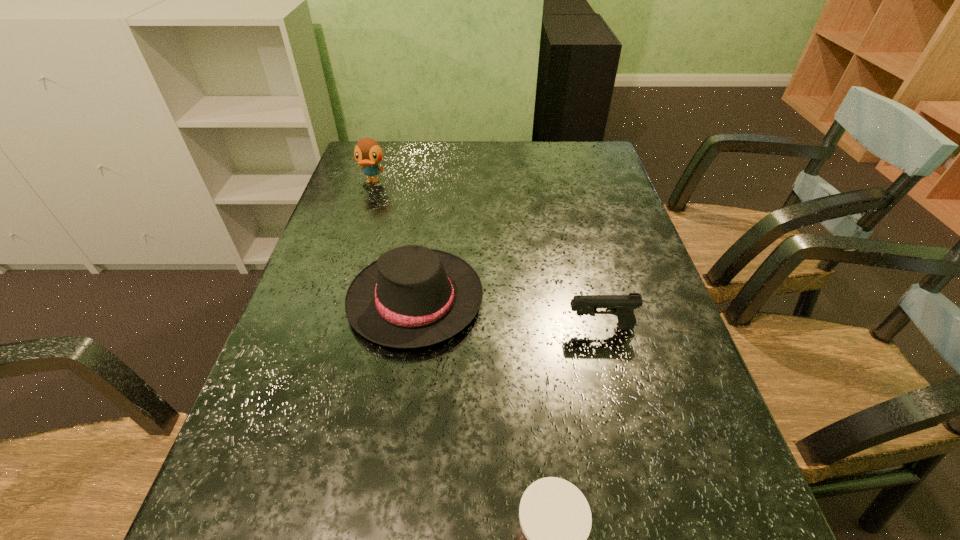
Find the location of a particular element. This screenshot has width=960, height=540. vacant space in between the dress hat and the duck is located at coordinates pyautogui.click(x=394, y=241).

Find the location of a particular element. This screenshot has width=960, height=540. empty location between the duck and the dress hat is located at coordinates point(394,241).

I want to click on empty space that is in between the dress hat and the farthest object, so click(x=394, y=241).

Find the location of a particular element. The height and width of the screenshot is (540, 960). vacant space that's between the dress hat and the farthest object is located at coordinates (394, 241).

The image size is (960, 540). What are the coordinates of `vacant space that's between the dress hat and the pistol` in the screenshot? It's located at (508, 313).

Locate an element on the screen. This screenshot has height=540, width=960. object that ranks as the third closest to the Dixie cup is located at coordinates (368, 153).

Where is `the closest object to the pistol`? the closest object to the pistol is located at coordinates (412, 296).

Identify the location of free space that satisfies the following two spatial constraints: 1. on the front-facing side of the dress hat; 2. on the right side of the tallest object. The height and width of the screenshot is (540, 960). (334, 300).

Identify the location of free location that satisfies the following two spatial constraints: 1. on the front-facing side of the dress hat; 2. on the left side of the farthest object. (334, 300).

Locate an element on the screen. vacant region that satisfies the following two spatial constraints: 1. on the front-facing side of the farthest object; 2. on the left side of the dress hat is located at coordinates (334, 300).